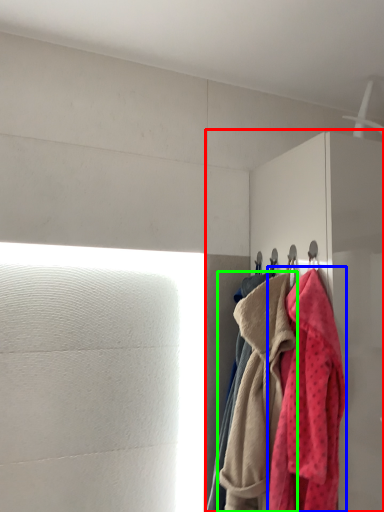
Question: Based on their relative distances, which object is nearer to dresser (highlighted by a red box)? Choose from towel (highlighted by a blue box) and towel (highlighted by a green box).

Choices:
 (A) towel
 (B) towel

Answer: (A)